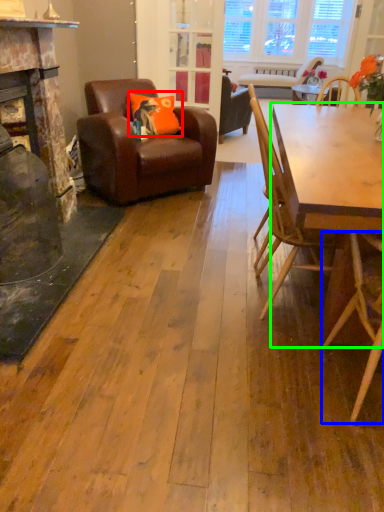
Question: Which object is positioned farthest from pillow (highlighted by a red box)? Select from chair (highlighted by a blue box) and round table (highlighted by a green box).

Choices:
 (A) chair
 (B) round table

Answer: (A)